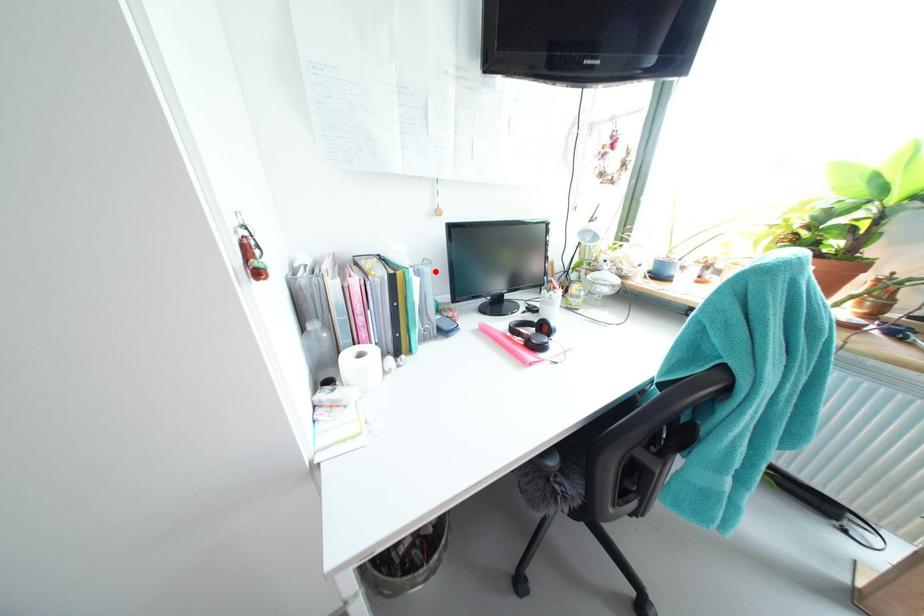
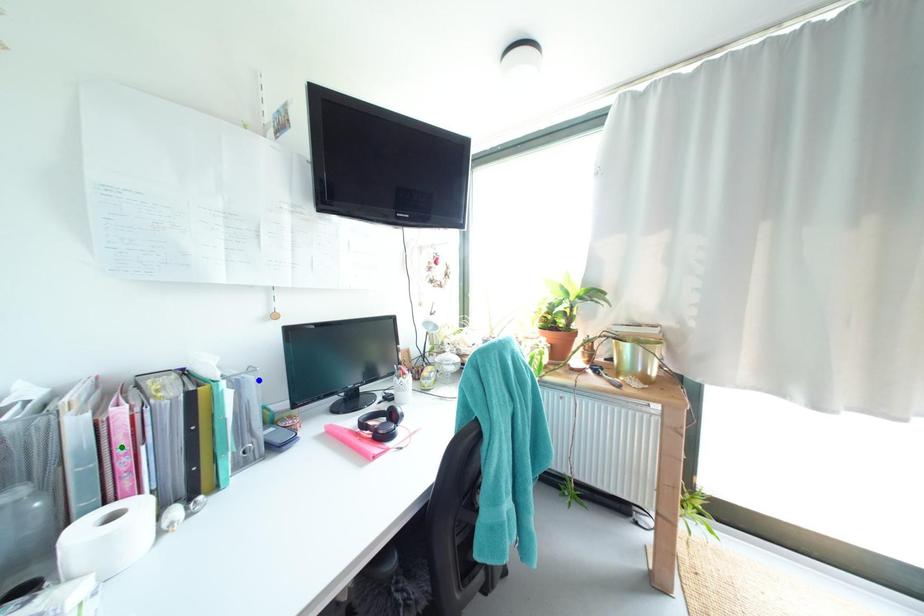
Question: I am providing you with two images of the same scene from different viewpoints. A red point is marked on the first image. You are given multiple points on the second image. Which point in image 2 is actually the same real-world point as the red point in image 1?

Choices:
 (A) blue point
 (B) yellow point
 (C) green point

Answer: (A)